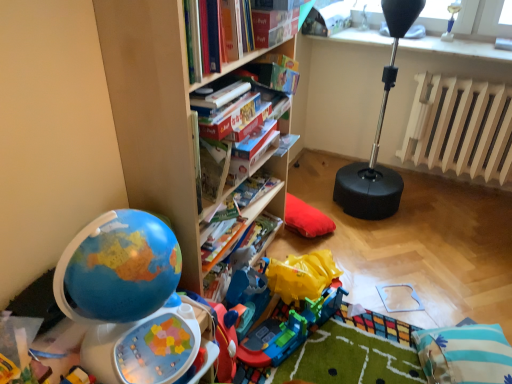
Question: Should I look upward or downward to see hardcover book at center, which ranks as the 1th paperback book in front-to-back order?

Choices:
 (A) up
 (B) down

Answer: (A)

Question: Does black rubber punching bag at upper right have a larger size compared to shiny plastic globe at left?

Choices:
 (A) no
 (B) yes

Answer: (A)

Question: Does black rubber punching bag at upper right have a smaller size compared to shiny plastic globe at left?

Choices:
 (A) yes
 (B) no

Answer: (A)

Question: Would you consider black rubber punching bag at upper right to be distant from shiny plastic globe at left?

Choices:
 (A) yes
 (B) no

Answer: (A)

Question: Does black rubber punching bag at upper right have a lesser width compared to shiny plastic globe at left?

Choices:
 (A) yes
 (B) no

Answer: (B)

Question: Is shiny plastic globe at left inside black rubber punching bag at upper right?

Choices:
 (A) yes
 (B) no

Answer: (B)

Question: From a real-world perspective, is black rubber punching bag at upper right located higher than shiny plastic globe at left?

Choices:
 (A) no
 (B) yes

Answer: (B)

Question: Does wooden bookshelf at center have a greater width compared to wooden radiator at right?

Choices:
 (A) no
 (B) yes

Answer: (B)

Question: Considering the relative sizes of wooden bookshelf at center and wooden radiator at right in the image provided, is wooden bookshelf at center bigger than wooden radiator at right?

Choices:
 (A) yes
 (B) no

Answer: (A)

Question: Considering the relative sizes of wooden bookshelf at center and wooden radiator at right in the image provided, is wooden bookshelf at center smaller than wooden radiator at right?

Choices:
 (A) yes
 (B) no

Answer: (B)

Question: Considering the relative sizes of wooden bookshelf at center and wooden radiator at right in the image provided, is wooden bookshelf at center thinner than wooden radiator at right?

Choices:
 (A) yes
 (B) no

Answer: (B)

Question: Could you tell me if wooden bookshelf at center is turned towards wooden radiator at right?

Choices:
 (A) no
 (B) yes

Answer: (A)

Question: Considering the relative sizes of wooden bookshelf at center and wooden radiator at right in the image provided, is wooden bookshelf at center shorter than wooden radiator at right?

Choices:
 (A) no
 (B) yes

Answer: (A)

Question: Does blue striped pillow at lower right have a smaller size compared to wooden bookshelf at center?

Choices:
 (A) no
 (B) yes

Answer: (B)